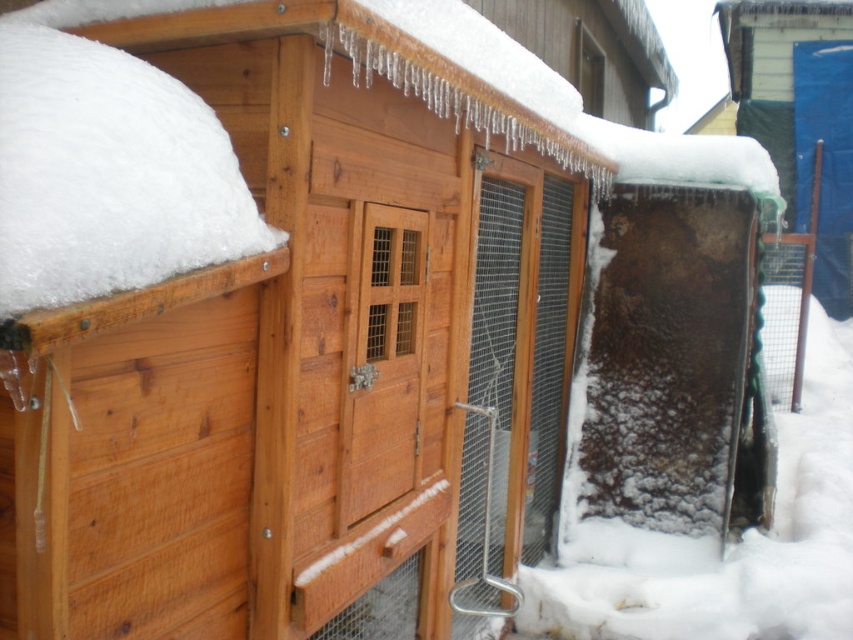
Question: Does frosted glass door at right appear over wooden screen door at center?

Choices:
 (A) no
 (B) yes

Answer: (A)

Question: Is white fluffy snow at upper left below frosted glass door at right?

Choices:
 (A) yes
 (B) no

Answer: (B)

Question: Which point is closer to the camera taking this photo?

Choices:
 (A) (547, 628)
 (B) (368, 339)

Answer: (B)

Question: Which object is positioned closest to the frosted glass door at right?

Choices:
 (A) white fluffy snow at upper left
 (B) wooden screen door at center

Answer: (B)

Question: Is frosted glass door at right below wooden screen door at center?

Choices:
 (A) yes
 (B) no

Answer: (A)

Question: Which of the following is the closest to the observer?

Choices:
 (A) (415, 326)
 (B) (32, 26)
 (C) (815, 308)

Answer: (B)